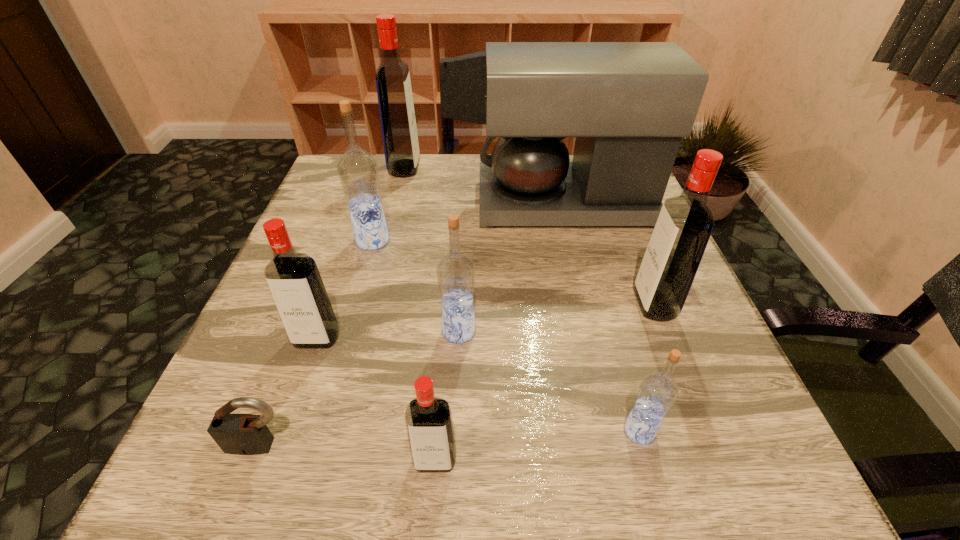
At what (x,y) coordinates should I click in order to perform the action: click on the nearest red vodka. Please return your answer as a coordinate pair (x, y). Image resolution: width=960 pixels, height=540 pixels. Looking at the image, I should click on (429, 423).

The width and height of the screenshot is (960, 540). Find the location of `the second red vodka from right to left`. the second red vodka from right to left is located at coordinates (429, 423).

Image resolution: width=960 pixels, height=540 pixels. I want to click on the rightmost blue vodka, so click(x=658, y=391).

In order to click on the nearest blue vodka in this screenshot , I will do `click(658, 391)`.

Where is `padlock`? The height and width of the screenshot is (540, 960). padlock is located at coordinates (241, 434).

Locate an element on the screen. The height and width of the screenshot is (540, 960). blank space located on the front and back of the farthest vodka is located at coordinates (494, 168).

Where is `vacant point located on the carafe side of the coffee maker`? vacant point located on the carafe side of the coffee maker is located at coordinates (328, 204).

Locate an element on the screen. The image size is (960, 540). free space located on the carafe side of the coffee maker is located at coordinates (371, 204).

Locate an element on the screen. vacant area located 0.140m on the carafe side of the coffee maker is located at coordinates (420, 204).

Image resolution: width=960 pixels, height=540 pixels. Identify the location of vacant area located 0.280m on the right of the farthest blue vodka. (520, 241).